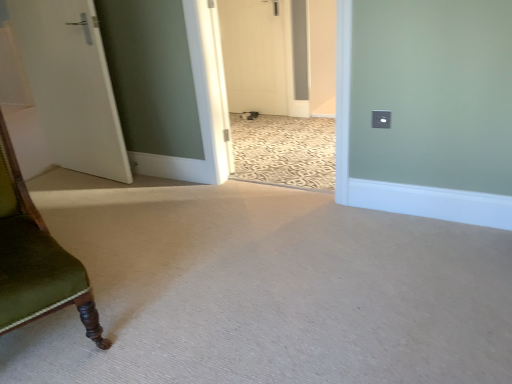
What is the approximate height of white matte door at left, the second door viewed from the right?

The height of white matte door at left, the second door viewed from the right, is 1.14 meters.

Measure the distance between point (300,55) and camera.

Point (300,55) and camera are 3.67 meters apart.

Locate an element on the screen. This screenshot has height=384, width=512. green velvet chair at left is located at coordinates (35, 259).

From the image's perspective, does green velvet chair at left appear lower than white matte door at center, the 1th door from the right?

Yes.

Considering the points (42, 285) and (295, 114), which point is behind, point (42, 285) or point (295, 114)?

Point (295, 114)

Consider the image. Is green velvet chair at left wider than white matte door at center, which ranks as the first door in back-to-front order?

Yes.

Is green velvet chair at left inside the boundaries of white matte door at center, which is the second door from left to right, or outside?

green velvet chair at left is outside white matte door at center, which is the second door from left to right.

Is white matte door at center, the second door when ordered from front to back, in contact with green velvet chair at left?

No, white matte door at center, the second door when ordered from front to back, is not in contact with green velvet chair at left.

Is white matte door at center, which is the second door from left to right, turned away from green velvet chair at left?

That's not correct — white matte door at center, which is the second door from left to right, is not looking away from green velvet chair at left.

Consider the image. Which is nearer, (256,27) or (58,283)?

Clearly, point (256,27) is more distant from the camera than point (58,283).

Is white matte door at left, which is the second door from back to front, smaller than white matte door at center, the 1th door from the right?

Incorrect, white matte door at left, which is the second door from back to front, is not smaller in size than white matte door at center, the 1th door from the right.

Which of these two, white matte door at left, the second door viewed from the right, or white matte door at center, which is the second door from left to right, stands shorter?

With less height is white matte door at center, which is the second door from left to right.

Between white matte door at left, which is counted as the 1th door, starting from the front, and white matte door at center, which is the second door from left to right, which one appears on the left side from the viewer's perspective?

Positioned to the left is white matte door at left, which is counted as the 1th door, starting from the front.

From the image's perspective, is white matte door at left, which appears as the 1th door when viewed from the left, beneath white matte door at center, which ranks as the first door in back-to-front order?

Yes.

Which object is positioned more to the right, white matte door at center, which is the second door from left to right, or white matte door at left, which appears as the 1th door when viewed from the left?

white matte door at center, which is the second door from left to right.

In the image, there is a white matte door at left, which is the second door from back to front. Where is `door below it (from a real-world perspective)`? door below it (from a real-world perspective) is located at coordinates (262, 56).

From the picture: Can we say white matte door at center, which is the second door from left to right, lies outside white matte door at left, which is counted as the 1th door, starting from the front?

white matte door at center, which is the second door from left to right, is positioned outside white matte door at left, which is counted as the 1th door, starting from the front.

Is green velvet chair at left oriented away from white matte door at left, the second door viewed from the right?

That's not correct — green velvet chair at left is not looking away from white matte door at left, the second door viewed from the right.

Does point (15, 225) come behind point (53, 105)?

That is False.

Between green velvet chair at left and white matte door at left, which is counted as the 1th door, starting from the front, which one has larger size?

With larger size is green velvet chair at left.

From a real-world perspective, who is located lower, green velvet chair at left or white matte door at left, which appears as the 1th door when viewed from the left?

From a 3D spatial view, green velvet chair at left is below.

From a real-world perspective, which is physically above, white matte door at left, which appears as the 1th door when viewed from the left, or green velvet chair at left?

In real-world perspective, white matte door at left, which appears as the 1th door when viewed from the left, is above.

Is green velvet chair at left located within white matte door at left, which is the second door from back to front?

No, green velvet chair at left is not surrounded by white matte door at left, which is the second door from back to front.

From their relative heights in the image, would you say white matte door at left, which is the second door from back to front, is taller or shorter than green velvet chair at left?

Considering their sizes, white matte door at left, which is the second door from back to front, has more height than green velvet chair at left.

Which object is wider, white matte door at left, which is the second door from back to front, or green velvet chair at left?

With larger width is green velvet chair at left.

Locate an element on the screen. This screenshot has height=384, width=512. door that is the 2nd object located behind the green velvet chair at left is located at coordinates (262, 56).

The height and width of the screenshot is (384, 512). In order to click on furniture lying on the left of white matte door at center, the second door when ordered from front to back in this screenshot , I will do `click(35, 259)`.

Estimate the real-world distances between objects in this image. Which object is further from green velvet chair at left, white matte door at center, the second door when ordered from front to back, or white matte door at left, which is the second door from back to front?

white matte door at center, the second door when ordered from front to back, lies further to green velvet chair at left than the other object.

From the image, which object appears to be farther from white matte door at left, the second door viewed from the right, white matte door at center, which is the second door from left to right, or green velvet chair at left?

white matte door at center, which is the second door from left to right, lies further to white matte door at left, the second door viewed from the right, than the other object.

When comparing their distances from white matte door at center, the 1th door from the right, does green velvet chair at left or white matte door at left, which is the second door from back to front, seem closer?

Based on the image, white matte door at left, which is the second door from back to front, appears to be nearer to white matte door at center, the 1th door from the right.

Estimate the real-world distances between objects in this image. Which object is closer to green velvet chair at left, white matte door at left, the second door viewed from the right, or white matte door at center, which ranks as the first door in back-to-front order?

The object closer to green velvet chair at left is white matte door at left, the second door viewed from the right.

Looking at the image, which one is located closer to white matte door at center, the 1th door from the right, white matte door at left, which is counted as the 1th door, starting from the front, or green velvet chair at left?

The object closer to white matte door at center, the 1th door from the right, is white matte door at left, which is counted as the 1th door, starting from the front.

Which object lies nearer to the anchor point white matte door at left, which is counted as the 1th door, starting from the front, green velvet chair at left or white matte door at center, which is the second door from left to right?

The object closer to white matte door at left, which is counted as the 1th door, starting from the front, is green velvet chair at left.

The width and height of the screenshot is (512, 384). I want to click on door positioned between green velvet chair at left and white matte door at center, the 1th door from the right, from near to far, so click(x=71, y=85).